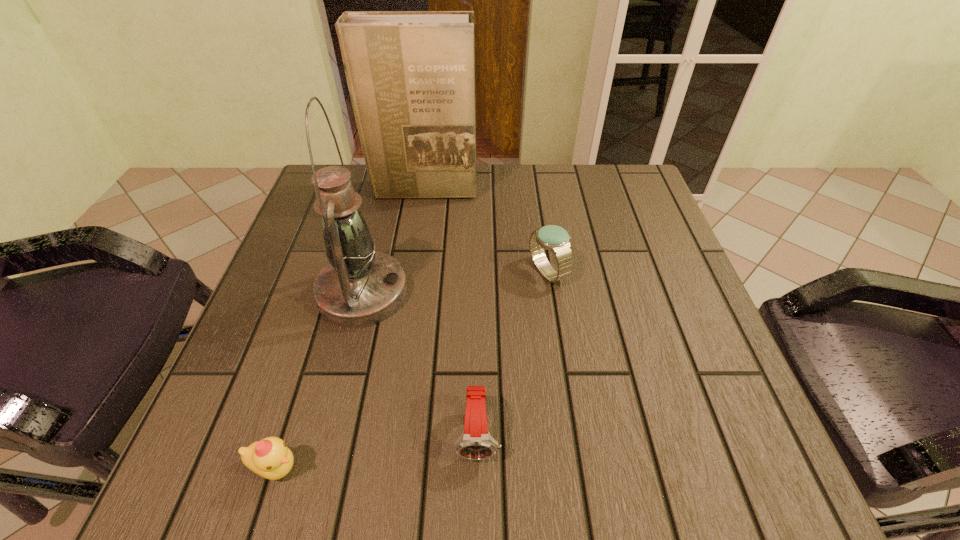
You are a GUI agent. You are given a task and a screenshot of the screen. Output one action in this format:
    pyautogui.click(x=<x>, y=<y>)
    Task: Click on the object that is at the far edge
    This screenshot has width=960, height=540.
    Given the screenshot: What is the action you would take?
    pyautogui.click(x=411, y=74)

Where is `watch at the near edge`? The height and width of the screenshot is (540, 960). watch at the near edge is located at coordinates (475, 443).

At what (x,y) coordinates should I click in order to perform the action: click on duckling that is at the near edge. Please return your answer as a coordinate pair (x, y). This screenshot has height=540, width=960. Looking at the image, I should click on (270, 458).

Image resolution: width=960 pixels, height=540 pixels. I want to click on phonebook at the left edge, so click(411, 74).

Locate an element on the screen. This screenshot has width=960, height=540. oil lamp that is at the left edge is located at coordinates (359, 287).

Locate an element on the screen. duckling positioned at the left edge is located at coordinates (270, 458).

Where is `object present at the far left corner`? This screenshot has height=540, width=960. object present at the far left corner is located at coordinates (411, 74).

Find the location of a particular element. This screenshot has height=540, width=960. object that is at the near left corner is located at coordinates tap(270, 458).

Identify the location of vacant space at the far edge of the desktop. (516, 172).

Where is `free space at the near edge of the desktop`? This screenshot has width=960, height=540. free space at the near edge of the desktop is located at coordinates (643, 449).